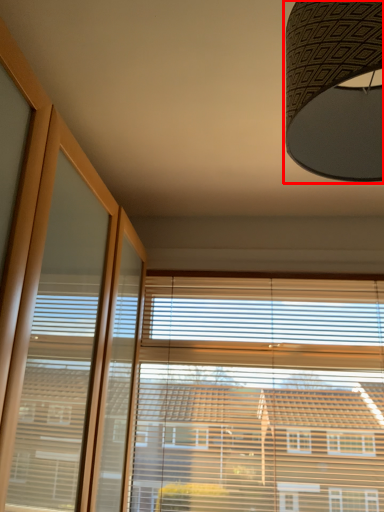
Question: From the image, what is the correct spatial relationship of lamp (annotated by the red box) in relation to bay window?

Choices:
 (A) right
 (B) left

Answer: (B)